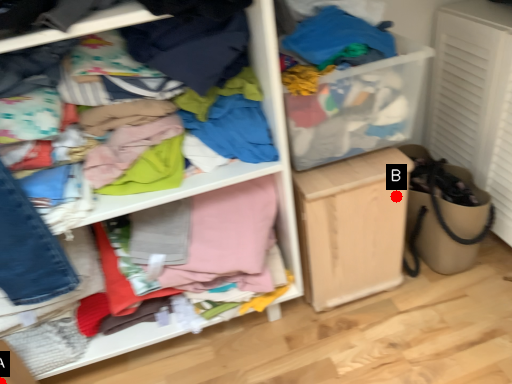
Question: Two points are circled on the image, labeled by A and B beside each circle. Which point is closer to the camera?

Choices:
 (A) A is closer
 (B) B is closer

Answer: (A)